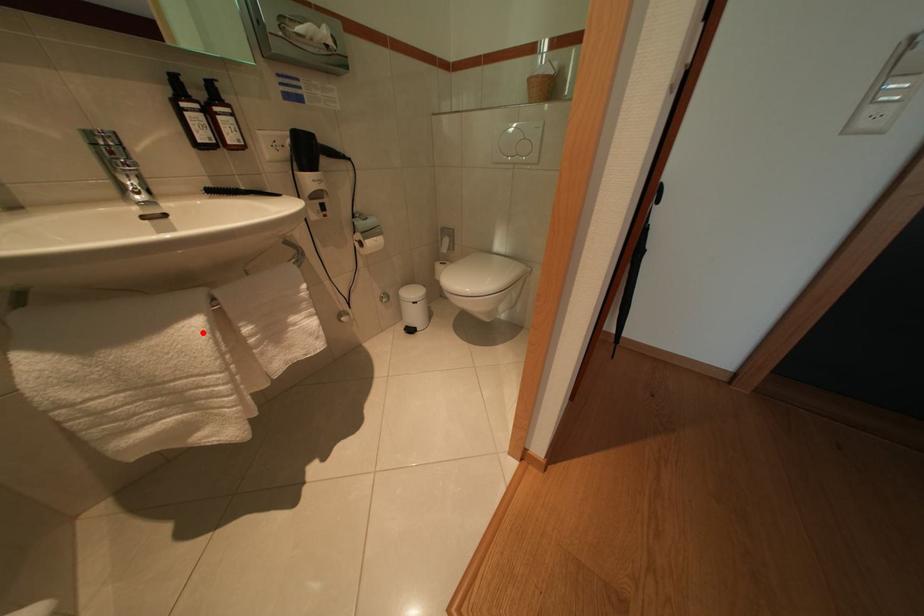
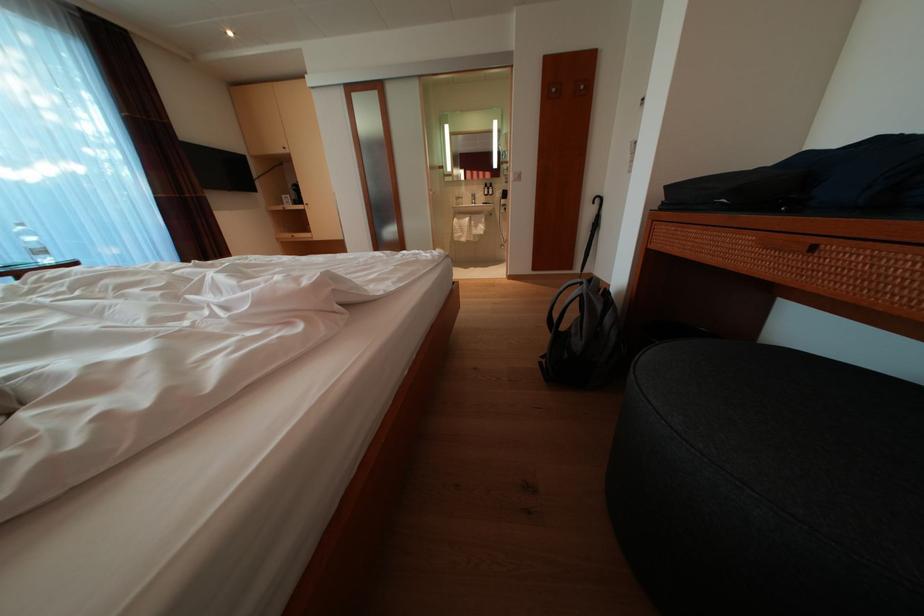
Question: I am providing you with two images of the same scene from different viewpoints. A red point is shown in image1. For the corresponding object point in image2, is it positioned nearer or farther from the camera?

Choices:
 (A) Nearer
 (B) Farther

Answer: (A)